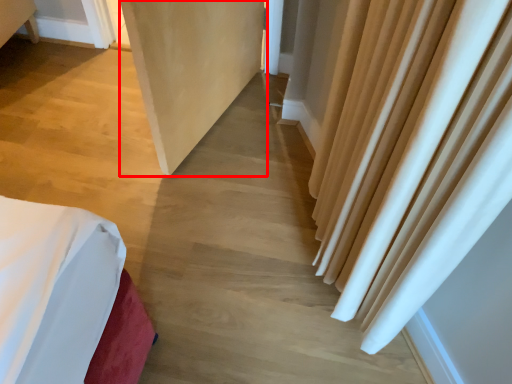
Question: From the image's perspective, considering the relative positions of screen door (annotated by the red box) and curtain in the image provided, where is screen door (annotated by the red box) located with respect to the staircase?

Choices:
 (A) below
 (B) above

Answer: (B)